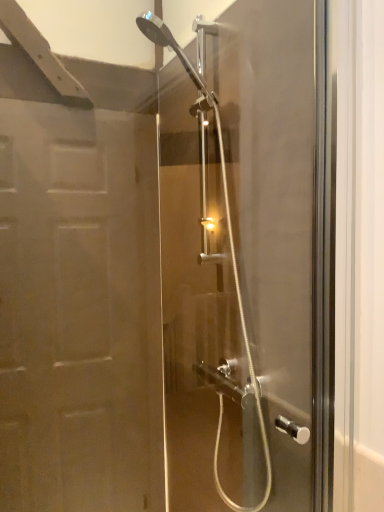
Locate an element on the screen. The height and width of the screenshot is (512, 384). polished chrome shower head at upper center is located at coordinates (241, 255).

Measure the distance between point (207, 319) and camera.

1.35 meters.

Describe the element at coordinates (241, 255) in the screenshot. I see `polished chrome shower head at upper center` at that location.

The image size is (384, 512). Find the location of `polished chrome shower head at upper center`. polished chrome shower head at upper center is located at coordinates (241, 255).